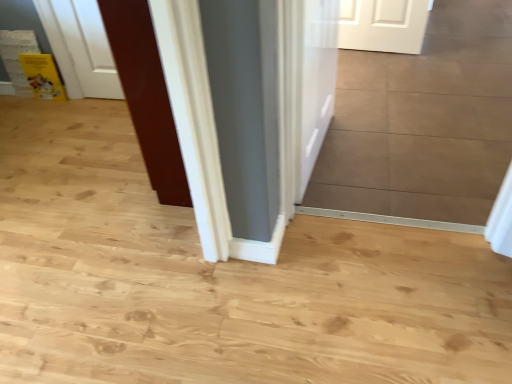
Question: Is white glossy door at center, which appears as the 1th door when viewed from the right, positioned before glossy wood door at center, arranged as the first door when viewed from the left?

Choices:
 (A) no
 (B) yes

Answer: (B)

Question: Considering the relative sizes of white glossy door at center, which appears as the 1th door when viewed from the right, and glossy wood door at center, which is the 2th door in right-to-left order, in the image provided, is white glossy door at center, which appears as the 1th door when viewed from the right, taller than glossy wood door at center, which is the 2th door in right-to-left order,?

Choices:
 (A) no
 (B) yes

Answer: (A)

Question: Is white glossy door at center, which is the second door from left to right, smaller than glossy wood door at center, arranged as the first door when viewed from the left?

Choices:
 (A) no
 (B) yes

Answer: (B)

Question: Is white glossy door at center, which appears as the 1th door when viewed from the right, oriented away from glossy wood door at center, which is the 2th door in right-to-left order?

Choices:
 (A) no
 (B) yes

Answer: (B)

Question: Does white glossy door at center, which appears as the 1th door when viewed from the right, have a lesser width compared to glossy wood door at center, arranged as the first door when viewed from the left?

Choices:
 (A) yes
 (B) no

Answer: (A)

Question: Is white glossy door at center, which is the second door from left to right, positioned beyond the bounds of glossy wood door at center, arranged as the first door when viewed from the left?

Choices:
 (A) no
 (B) yes

Answer: (B)

Question: Is white glossy door at center, which is the second door from left to right, located within glossy wood door at center, which is the 2th door in right-to-left order?

Choices:
 (A) yes
 (B) no

Answer: (B)

Question: Considering the relative sizes of glossy wood door at center, arranged as the first door when viewed from the left, and white glossy door at center, which appears as the 1th door when viewed from the right, in the image provided, is glossy wood door at center, arranged as the first door when viewed from the left, thinner than white glossy door at center, which appears as the 1th door when viewed from the right,?

Choices:
 (A) yes
 (B) no

Answer: (B)

Question: Considering the relative positions of glossy wood door at center, arranged as the first door when viewed from the left, and white glossy door at center, which is the second door from left to right, in the image provided, is glossy wood door at center, arranged as the first door when viewed from the left, to the right of white glossy door at center, which is the second door from left to right, from the viewer's perspective?

Choices:
 (A) yes
 (B) no

Answer: (B)

Question: From the image's perspective, is glossy wood door at center, arranged as the first door when viewed from the left, on top of white glossy door at center, which is the second door from left to right?

Choices:
 (A) yes
 (B) no

Answer: (B)

Question: From a real-world perspective, is glossy wood door at center, arranged as the first door when viewed from the left, on top of white glossy door at center, which appears as the 1th door when viewed from the right?

Choices:
 (A) no
 (B) yes

Answer: (B)

Question: Could you tell me if glossy wood door at center, arranged as the first door when viewed from the left, is turned towards white glossy door at center, which is the second door from left to right?

Choices:
 (A) yes
 (B) no

Answer: (B)

Question: Is point (148, 104) positioned closer to the camera than point (325, 120)?

Choices:
 (A) farther
 (B) closer

Answer: (B)